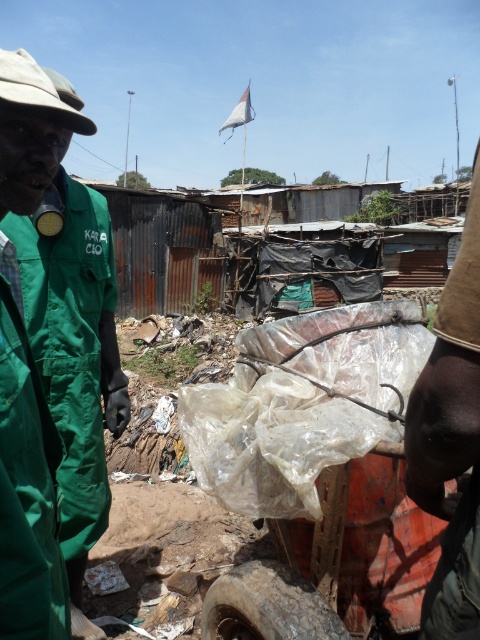
Is transparent plastic wagon at center above rusty rubber tire at lower center?

Indeed, transparent plastic wagon at center is positioned over rusty rubber tire at lower center.

Who is taller, transparent plastic wagon at center or rusty rubber tire at lower center?

→ Standing taller between the two is transparent plastic wagon at center.

Who is more forward, (375, 483) or (217, 616)?

Point (375, 483) is in front.

Where is `transparent plastic wagon at center`? transparent plastic wagon at center is located at coordinates (336, 563).

Between transparent plastic wagon at center and green fabric jacket at left, which one appears on the right side from the viewer's perspective?

transparent plastic wagon at center is more to the right.

Which is below, transparent plastic wagon at center or green fabric jacket at left?

Positioned lower is transparent plastic wagon at center.

Between point (314, 602) and point (22, 268), which one is positioned behind?

The point (22, 268) is more distant.

Find the location of a particular element. transparent plastic wagon at center is located at coordinates (336, 563).

The height and width of the screenshot is (640, 480). In order to click on brown fabric cap at upper right in this screenshot , I will do `click(451, 440)`.

Is point (444, 332) positioned in front of point (218, 593)?

Yes, point (444, 332) is in front of point (218, 593).

Measure the distance between point (x=466, y=628) and camera.

Point (x=466, y=628) is 94.67 centimeters from camera.

Where is `brown fabric cap at upper right`? brown fabric cap at upper right is located at coordinates (451, 440).